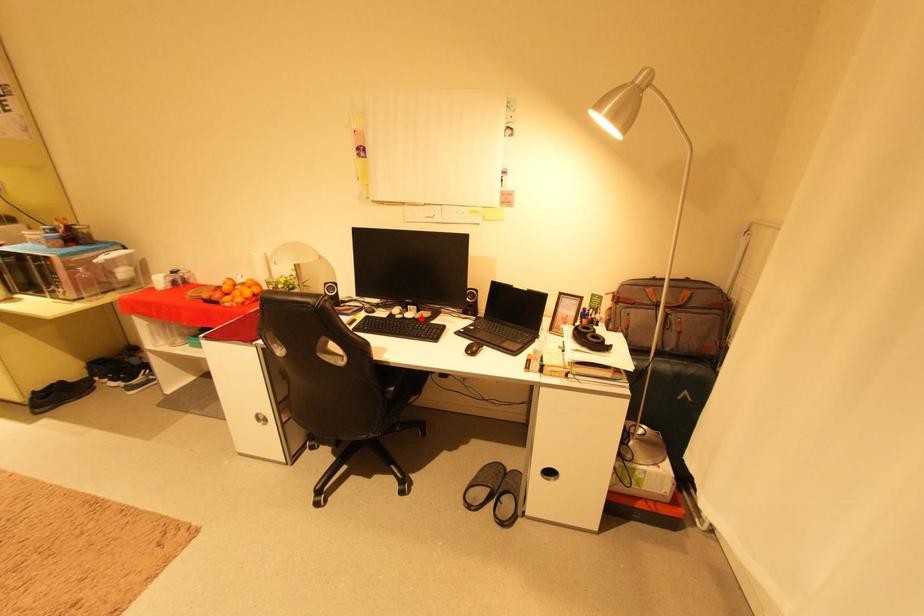
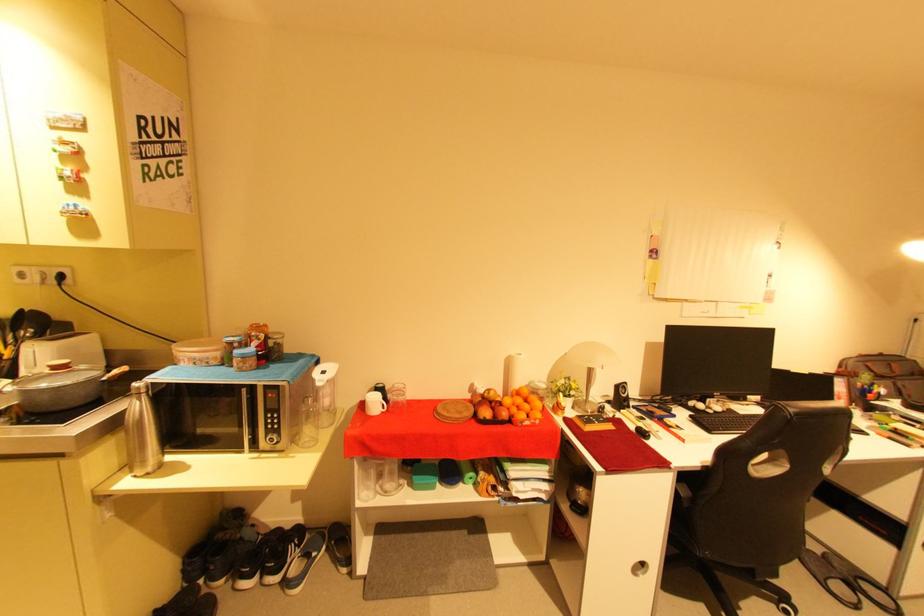
Locate, in the second image, the point that corresponds to the highlighted location in the first image.

(730, 411)